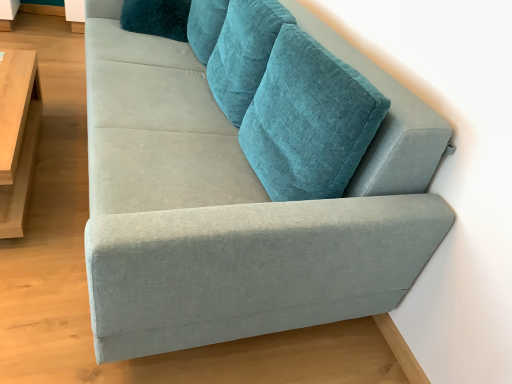
Question: Can you confirm if light wood/wooden table at left is shorter than velvet teal couch at upper right?

Choices:
 (A) no
 (B) yes

Answer: (B)

Question: Would you say light wood/wooden table at left is outside velvet teal couch at upper right?

Choices:
 (A) no
 (B) yes

Answer: (B)

Question: Are light wood/wooden table at left and velvet teal couch at upper right beside each other?

Choices:
 (A) yes
 (B) no

Answer: (B)

Question: From a real-world perspective, does light wood/wooden table at left sit lower than velvet teal couch at upper right?

Choices:
 (A) no
 (B) yes

Answer: (B)

Question: Can you confirm if light wood/wooden table at left is positioned to the left of velvet teal couch at upper right?

Choices:
 (A) no
 (B) yes

Answer: (B)

Question: From a real-world perspective, is light wood/wooden table at left on top of velvet teal couch at upper right?

Choices:
 (A) no
 (B) yes

Answer: (A)

Question: Does teal velvet pillow at upper center turn towards light wood/wooden table at left?

Choices:
 (A) no
 (B) yes

Answer: (B)

Question: Does teal velvet pillow at upper center come behind light wood/wooden table at left?

Choices:
 (A) no
 (B) yes

Answer: (B)

Question: Can you confirm if teal velvet pillow at upper center is thinner than light wood/wooden table at left?

Choices:
 (A) yes
 (B) no

Answer: (B)

Question: Does teal velvet pillow at upper center have a greater width compared to light wood/wooden table at left?

Choices:
 (A) yes
 (B) no

Answer: (A)

Question: Is teal velvet pillow at upper center shorter than light wood/wooden table at left?

Choices:
 (A) no
 (B) yes

Answer: (B)

Question: From the image's perspective, would you say teal velvet pillow at upper center is positioned over light wood/wooden table at left?

Choices:
 (A) no
 (B) yes

Answer: (B)

Question: Does velvet teal couch at upper right have a lesser height compared to teal velvet pillow at upper center?

Choices:
 (A) yes
 (B) no

Answer: (B)